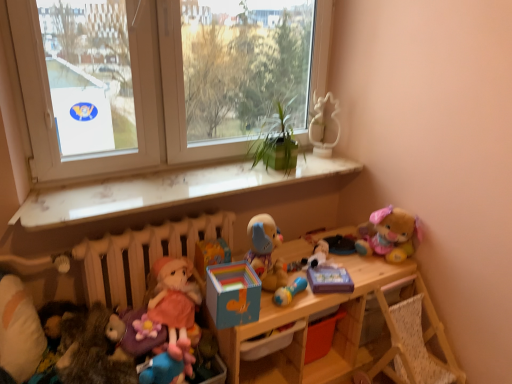
Identify the location of free point above velvet purple doll at lower left, positioned as the 2th toy in left-to-right order (from a real-world perspective). Image resolution: width=512 pixels, height=384 pixels. (143, 317).